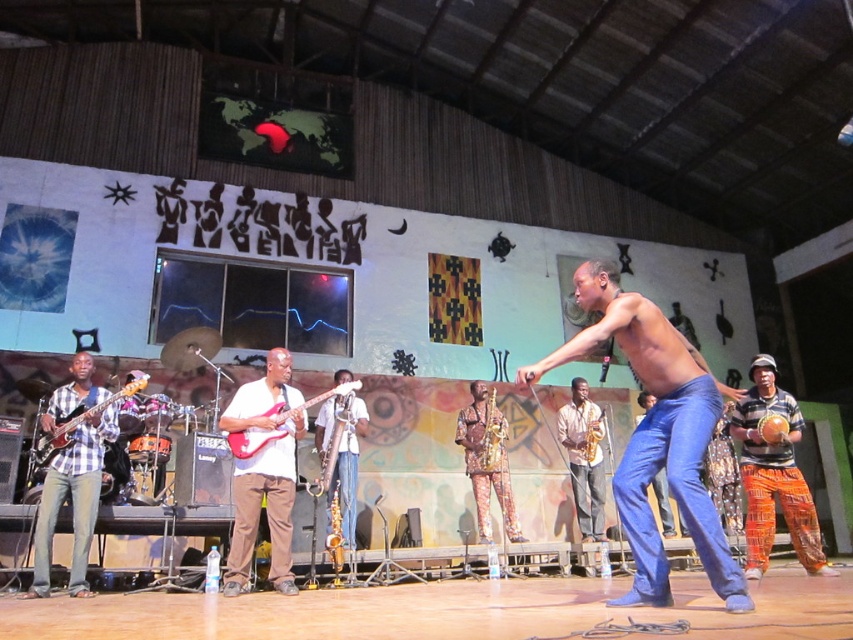
Question: Is matte black electric guitar at left smaller than blue jeans at center?

Choices:
 (A) yes
 (B) no

Answer: (A)

Question: Which object is positioned closest to the orange printed pants at right?

Choices:
 (A) gold brass saxophone at center
 (B) shiny blue jeans at center
 (C) satin gold saxophone at center
 (D) matte black electric guitar at center

Answer: (B)

Question: From the image, what is the correct spatial relationship of matte black electric guitar at center in relation to gold metallic saxophone at center?

Choices:
 (A) right
 (B) left

Answer: (B)

Question: Does orange printed pants at right have a smaller size compared to matte red electric guitar at center?

Choices:
 (A) yes
 (B) no

Answer: (B)

Question: Which point is farther from the camera taking this photo?

Choices:
 (A) (343, 394)
 (B) (587, 440)

Answer: (B)

Question: Which of the following is the farthest from the observer?

Choices:
 (A) (712, 573)
 (B) (335, 444)
 (C) (759, 529)

Answer: (B)